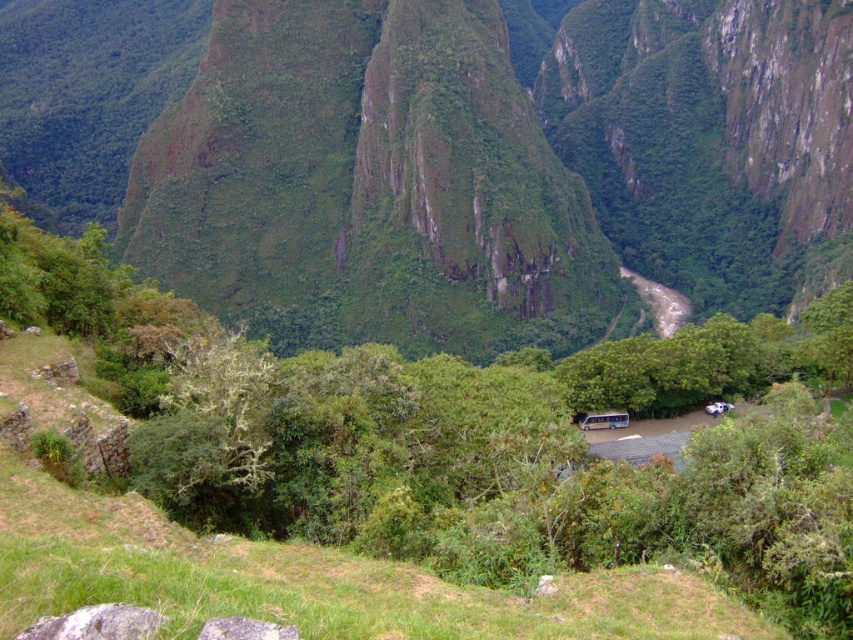
In the scene shown: You are a hiker planning to cross the brown rocky river at center. There is a path through the green leafy trees at center. Which direction should you go to reach the river without getting wet?

The green leafy trees at center are in front of the brown rocky river at center, so you should go through the path through the green leafy trees at center to reach the river without getting wet.